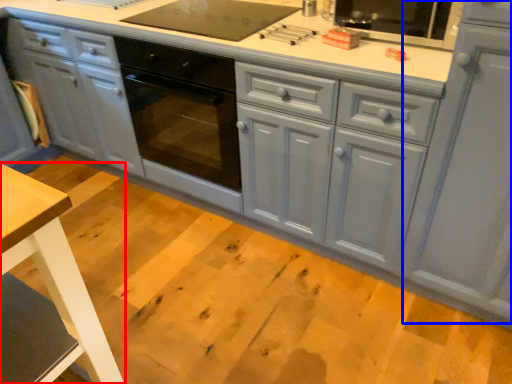
Question: Which point is closer to the camera, table (highlighted by a red box) or cabinetry (highlighted by a blue box)?

Choices:
 (A) table
 (B) cabinetry

Answer: (A)